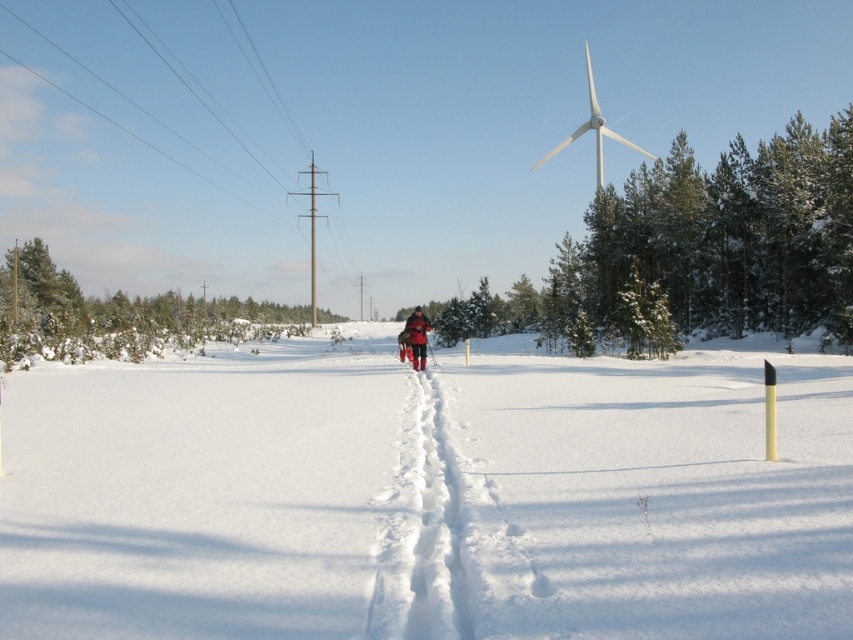
Is white powdery snow at center smaller than red fabric jacket at center?

Actually, white powdery snow at center might be larger than red fabric jacket at center.

Between point (782, 362) and point (424, 360), which one is positioned in front?

Point (424, 360) is in front.

Where is `white powdery snow at center`? white powdery snow at center is located at coordinates (425, 497).

Is point (397, 611) behind point (407, 326)?

That is False.

Which of these two, white fluffy snow trail at center or red fabric jacket at center, stands shorter?

white fluffy snow trail at center

What do you see at coordinates (421, 532) in the screenshot? The width and height of the screenshot is (853, 640). I see `white fluffy snow trail at center` at bounding box center [421, 532].

I want to click on white fluffy snow trail at center, so click(421, 532).

Is point (242, 417) in front of point (300, 216)?

Yes, point (242, 417) is in front of point (300, 216).

Based on the photo, who is shorter, white powdery snow at center or gray metallic windmill at center?

white powdery snow at center

Locate an element on the screen. white powdery snow at center is located at coordinates (425, 497).